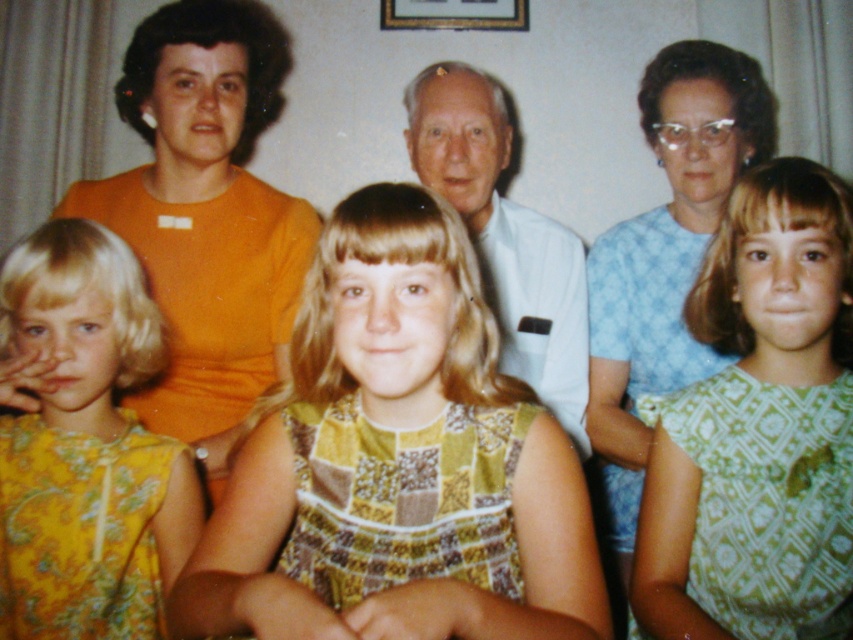
Between patterned fabric dress at center and white smooth shirt at center, which one is positioned higher?

white smooth shirt at center is higher up.

Is point (527, 465) less distant than point (415, 141)?

Yes, point (527, 465) is in front of point (415, 141).

The image size is (853, 640). In order to click on patterned fabric dress at center in this screenshot , I will do `click(398, 461)`.

Does yellow floral dress at left appear on the left side of white smooth shirt at center?

Yes, yellow floral dress at left is to the left of white smooth shirt at center.

Does yellow floral dress at left have a smaller size compared to white smooth shirt at center?

Indeed, yellow floral dress at left has a smaller size compared to white smooth shirt at center.

Is point (123, 272) behind point (482, 104)?

No, it is not.

The image size is (853, 640). Find the location of `yellow floral dress at left`. yellow floral dress at left is located at coordinates (86, 445).

Is yellow floral dress at left below gold/golden wood picture frame at upper center?

Indeed, yellow floral dress at left is positioned under gold/golden wood picture frame at upper center.

Between point (136, 380) and point (415, 19), which one is positioned behind?

The point (415, 19) is more distant.

This screenshot has height=640, width=853. What are the coordinates of `yellow floral dress at left` in the screenshot? It's located at (86, 445).